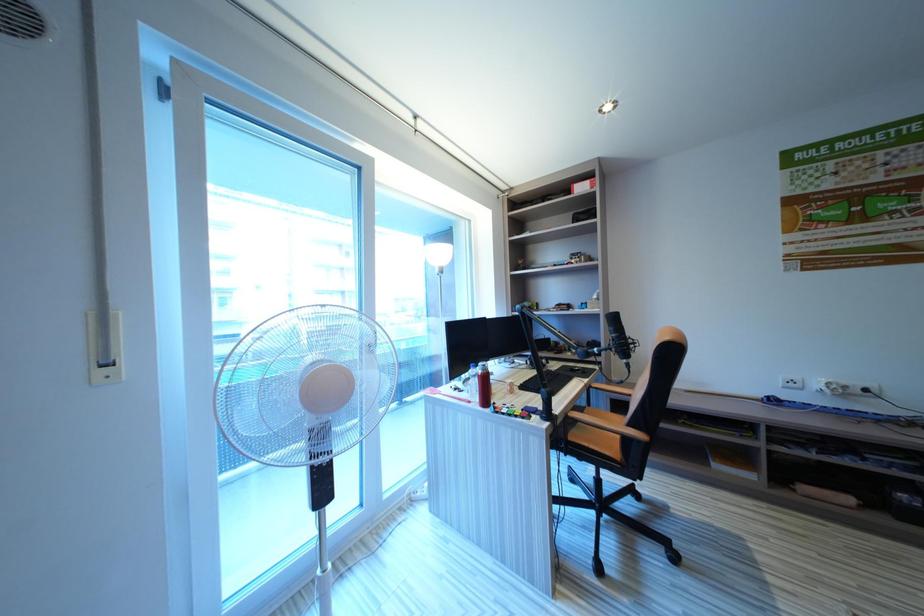
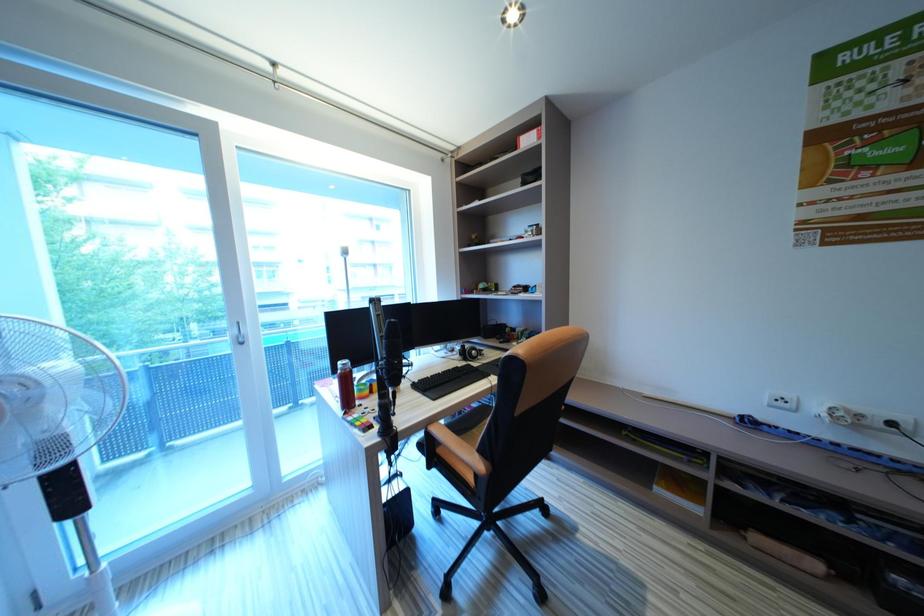
Question: What movement of the cameraman would produce the second image?

Choices:
 (A) Left
 (B) Right
 (C) Forward
 (D) Backward

Answer: (B)